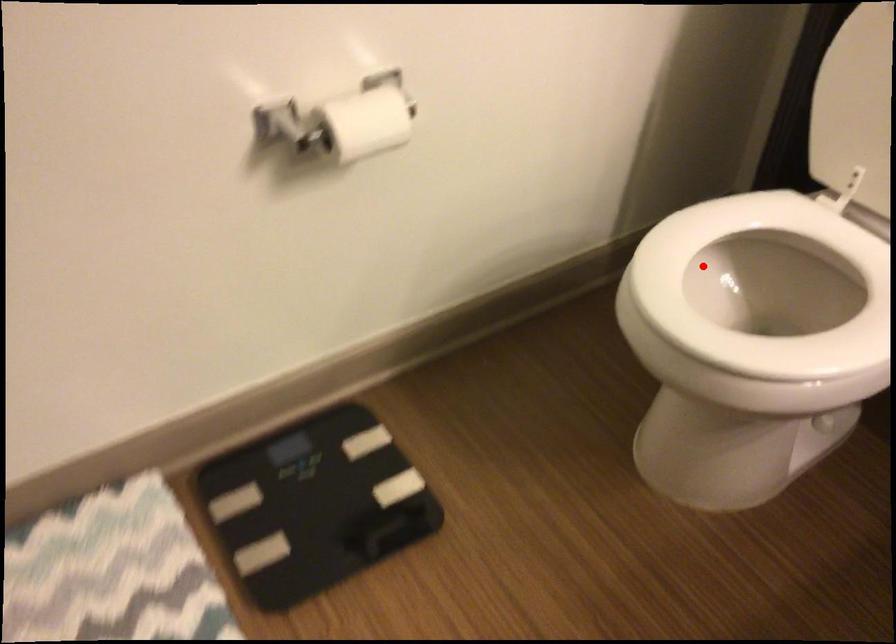
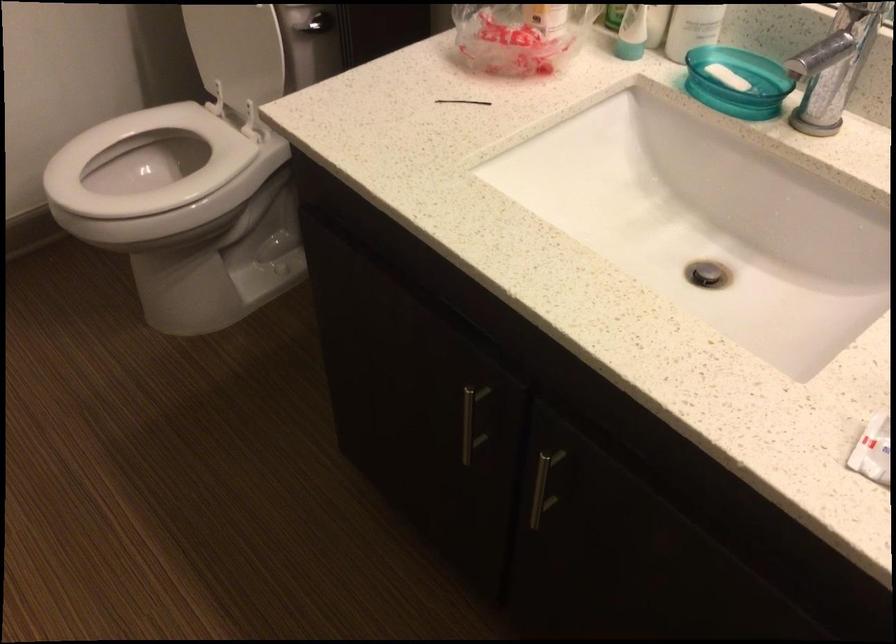
Question: I am providing you with two images of the same scene from different viewpoints. In image1, a red point is highlighted. Considering the same 3D point in image2, which of the following is correct?

Choices:
 (A) It is closer
 (B) It is farther

Answer: (B)